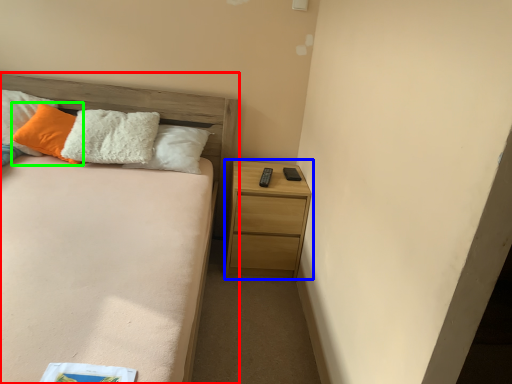
Question: Based on their relative distances, which object is nearer to bed (highlighted by a red box)? Choose from nightstand (highlighted by a blue box) and pillow (highlighted by a green box).

Choices:
 (A) nightstand
 (B) pillow

Answer: (B)